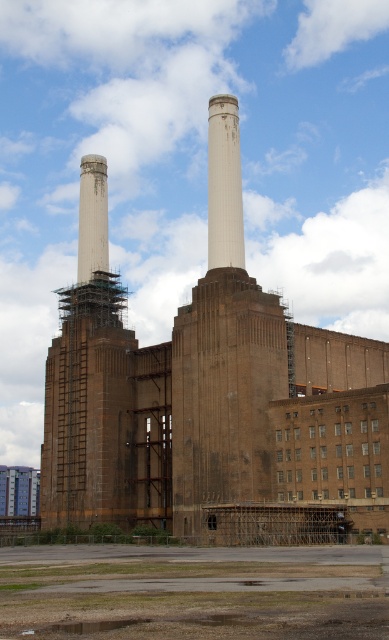
You are standing at the entrance of Battersea Power Station and want to locate the brown brick chimney at left. According to the coordinates provided, where should you look relative to your position?

The brown brick chimney at left is located at coordinates point [87,380], which means you should look to your upper right direction from your current position at the entrance.

You are standing in front of Battersea Power Station and want to take a photo that includes both the brown brick factory at center and the brown brick chimney at left. Based on their positions, which object should you place on the right side of your photo frame to ensure both are included?

You should place the brown brick factory at center on the right side of your photo frame because it is already positioned to the right of the brown brick chimney at left, ensuring both are included when the factory is on the right.